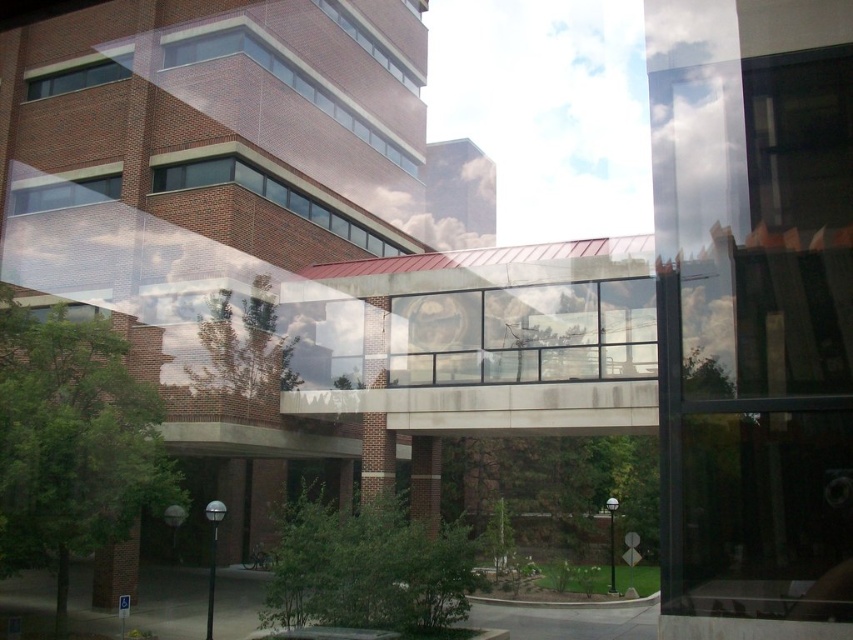
Question: Does brick wall at upper center appear on the right side of matte glass window at upper left?

Choices:
 (A) no
 (B) yes

Answer: (B)

Question: Is the position of clear glass window at upper left more distant than that of matte glass window at upper left?

Choices:
 (A) no
 (B) yes

Answer: (A)

Question: Considering the real-world distances, which object is farthest from the clear glass window at center?

Choices:
 (A) brick wall at upper center
 (B) matte glass window at upper left

Answer: (B)

Question: Which point appears farthest from the camera in this image?

Choices:
 (A) (161, 180)
 (B) (457, 292)
 (C) (393, 152)

Answer: (C)

Question: Is brick wall at upper center thinner than clear glass window at upper left?

Choices:
 (A) no
 (B) yes

Answer: (A)

Question: Which object appears closest to the camera in this image?

Choices:
 (A) clear glass window at upper left
 (B) brick wall at upper center

Answer: (B)